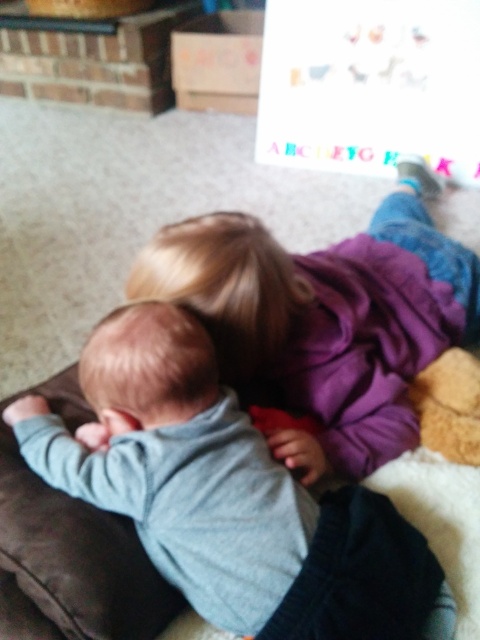
How far apart are gray soft baby at upper left and matte purple sweater at upper center?

A distance of 10.31 inches exists between gray soft baby at upper left and matte purple sweater at upper center.

Between point (361, 630) and point (409, 336), which one is positioned in front?

Point (361, 630) is more forward.

Is point (268, 470) farther from camera compared to point (211, 291)?

That is False.

Identify the location of gray soft baby at upper left. This screenshot has height=640, width=480. (222, 492).